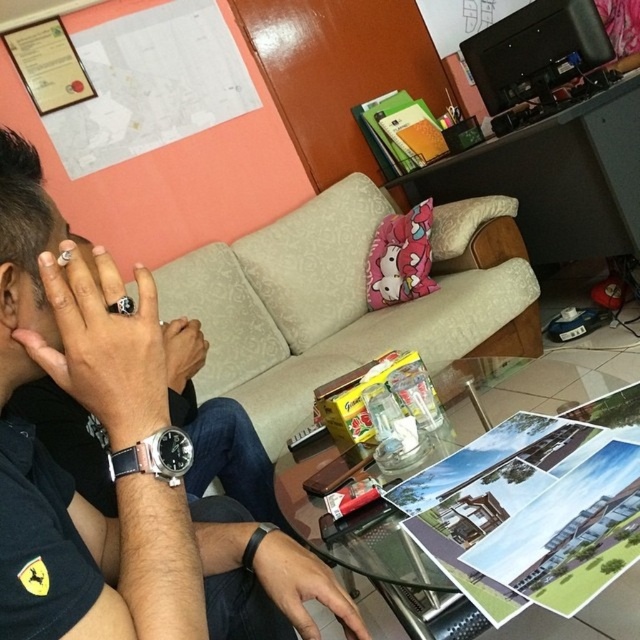
You are standing in the living room and want to place a large potted plant on the transparent glass table at center. According to the scene description, can you determine the exact coordinates where the table is located?

The transparent glass table at center is located at point (355, 536).